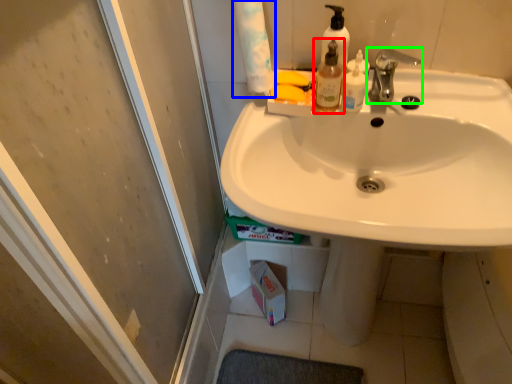
Question: Which object is positioned farthest from mouthwash (highlighted by a red box)? Select from toilet paper (highlighted by a blue box) and tap (highlighted by a green box).

Choices:
 (A) toilet paper
 (B) tap

Answer: (A)